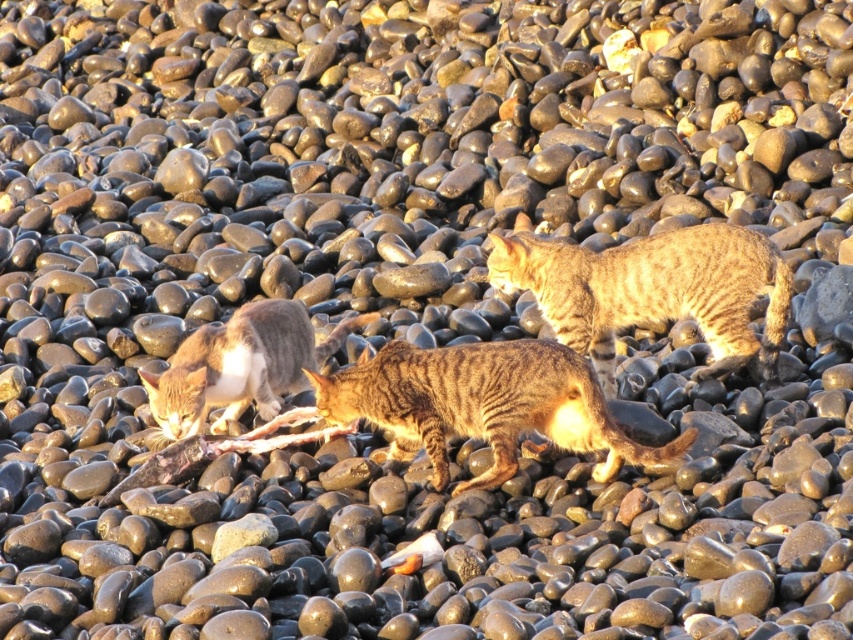
Which is in front, point (355, 384) or point (730, 353)?

Point (355, 384) is in front.

Is striped fur cat at center to the right of tabby fur cat at center from the viewer's perspective?

In fact, striped fur cat at center is to the left of tabby fur cat at center.

Describe the element at coordinates (485, 404) in the screenshot. This screenshot has height=640, width=853. I see `striped fur cat at center` at that location.

You are a GUI agent. You are given a task and a screenshot of the screen. Output one action in this format:
    pyautogui.click(x=<x>, y=<y>)
    Task: Click on the striped fur cat at center
    This screenshot has width=853, height=640.
    Given the screenshot: What is the action you would take?
    pyautogui.click(x=485, y=404)

Can you confirm if striped fur cat at center is wider than tabby fur cat at lower left?

Yes.

Between striped fur cat at center and tabby fur cat at lower left, which one has more height?

With more height is striped fur cat at center.

Does point (506, 349) come farther from viewer compared to point (223, 339)?

No, it is in front of (223, 339).

Where is `striped fur cat at center`? This screenshot has width=853, height=640. striped fur cat at center is located at coordinates (485, 404).

Between tabby fur cat at center and tabby fur cat at lower left, which one has more height?

tabby fur cat at center is taller.

Who is more distant from viewer, (606, 346) or (239, 339)?

The point (606, 346) is more distant.

Identify the location of tabby fur cat at center. The image size is (853, 640). (654, 291).